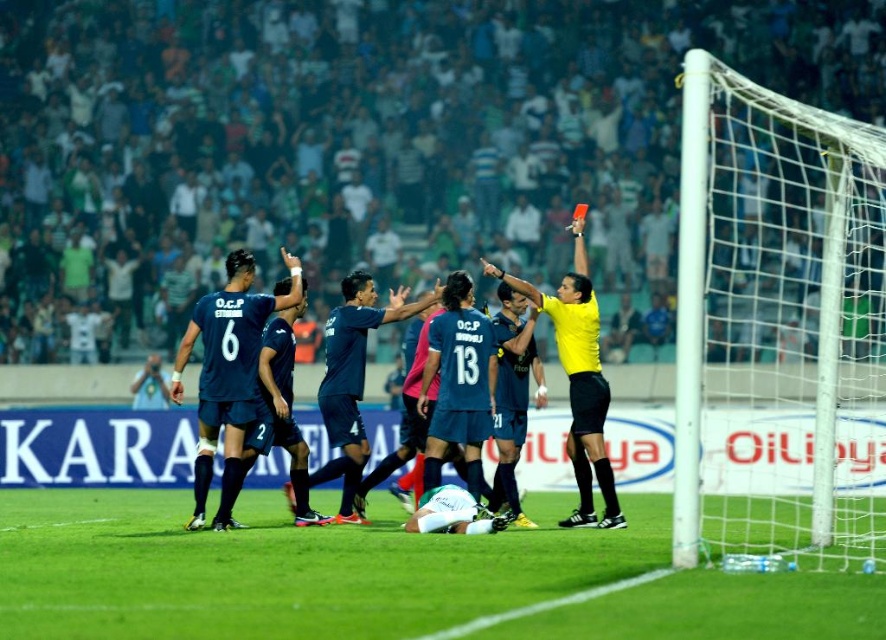
You are a soccer referee standing on the field. You notice the green grass at lower center and the dark blue jersey at center. Which object is taller?

The green grass at lower center is taller than the dark blue jersey at center.

You are a sports commentator watching the soccer match. You notice two players with dark blue jersey at center and yellow jersey at center. Which player should you mention first if you want to describe the taller player?

The yellow jersey at center is taller than the dark blue jersey at center, so you should mention the yellow jersey at center first when describing the taller player.

You are a referee standing at the center circle of the soccer field. You notice two points marked on the field at coordinates point (558, 556) and point (566, 364). Which point is closer to the goalpost on the right side of the frame?

Point (558, 556) is in front of point (566, 364), so it is closer to the goalpost on the right side of the frame.